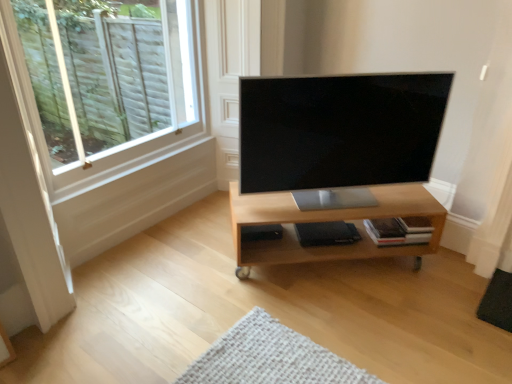
This screenshot has height=384, width=512. In order to click on satin black tv at center in this screenshot , I will do `click(339, 130)`.

This screenshot has height=384, width=512. What do you see at coordinates (339, 130) in the screenshot?
I see `satin black tv at center` at bounding box center [339, 130].

Identify the location of white wood window at upper left. (108, 89).

Based on their sizes in the image, would you say light wood shelf at center is bigger or smaller than white wood window at upper left?

Considering their sizes, light wood shelf at center takes up more space than white wood window at upper left.

Are light wood shelf at center and white wood window at upper left far apart?

light wood shelf at center is far away from white wood window at upper left.

Can you confirm if light wood shelf at center is wider than white wood window at upper left?

Indeed, light wood shelf at center has a greater width compared to white wood window at upper left.

Which is behind, point (371, 241) or point (286, 123)?

The point (371, 241) is farther.

Looking at this image, based on their positions, is light wood shelf at center located to the left or right of satin black tv at center?

light wood shelf at center is positioned on satin black tv at center's left side.

From a real-world perspective, is light wood shelf at center above or below satin black tv at center?

In terms of real-world spatial position, light wood shelf at center is below satin black tv at center.

At what (x,y) coordinates should I click in order to perform the action: click on shelf behind the satin black tv at center. Please return your answer as a coordinate pair (x, y). This screenshot has width=512, height=384. Looking at the image, I should click on (328, 221).

Is white wood window at upper left facing towards satin black tv at center?

Yes, white wood window at upper left is oriented towards satin black tv at center.

Is white wood window at upper left far from satin black tv at center?

Absolutely, white wood window at upper left is distant from satin black tv at center.

Between white wood window at upper left and satin black tv at center, which one is positioned in front?

white wood window at upper left is closer to the camera.

Considering the relative sizes of white wood window at upper left and satin black tv at center in the image provided, is white wood window at upper left wider than satin black tv at center?

In fact, white wood window at upper left might be narrower than satin black tv at center.

This screenshot has height=384, width=512. I want to click on television that appears on the right of light wood shelf at center, so click(x=339, y=130).

Does satin black tv at center touch light wood shelf at center?

No, satin black tv at center is not in contact with light wood shelf at center.

Considering the positions of objects satin black tv at center and light wood shelf at center in the image provided, who is behind, satin black tv at center or light wood shelf at center?

light wood shelf at center is more distant.

Considering the points (313, 183) and (303, 218), which point is in front, point (313, 183) or point (303, 218)?

The point (303, 218) is more forward.

How different are the orientations of satin black tv at center and white wood window at upper left in degrees?

The facing directions of satin black tv at center and white wood window at upper left are 43.9 degrees apart.

From a real-world perspective, which is physically above, satin black tv at center or white wood window at upper left?

white wood window at upper left is physically above.

Is satin black tv at center bigger or smaller than white wood window at upper left?

Clearly, satin black tv at center is smaller in size than white wood window at upper left.

Is satin black tv at center turned away from white wood window at upper left?

No, satin black tv at center is not facing away from white wood window at upper left.

From the image's perspective, is white wood window at upper left located above or below light wood shelf at center?

From the image's perspective, white wood window at upper left appears above light wood shelf at center.

Between white wood window at upper left and light wood shelf at center, which one has smaller size?

white wood window at upper left is smaller.

Which of these two, white wood window at upper left or light wood shelf at center, is wider?

light wood shelf at center is wider.

Locate an element on the screen. shelf on the right of white wood window at upper left is located at coordinates (328, 221).

This screenshot has width=512, height=384. In order to click on television that is above the light wood shelf at center (from the image's perspective) in this screenshot , I will do `click(339, 130)`.

From the image, which object appears to be farther from white wood window at upper left, light wood shelf at center or satin black tv at center?

light wood shelf at center is positioned further to the anchor white wood window at upper left.

Which object lies further to the anchor point light wood shelf at center, satin black tv at center or white wood window at upper left?

Based on the image, white wood window at upper left appears to be further to light wood shelf at center.

When comparing their distances from satin black tv at center, does light wood shelf at center or white wood window at upper left seem closer?

light wood shelf at center is closer to satin black tv at center.

Estimate the real-world distances between objects in this image. Which object is further from light wood shelf at center, white wood window at upper left or satin black tv at center?

The object further to light wood shelf at center is white wood window at upper left.

Looking at this image, looking at the image, which one is located further to white wood window at upper left, satin black tv at center or light wood shelf at center?

light wood shelf at center is further to white wood window at upper left.

When comparing their distances from satin black tv at center, does white wood window at upper left or light wood shelf at center seem closer?

light wood shelf at center lies closer to satin black tv at center than the other object.

Locate an element on the screen. The height and width of the screenshot is (384, 512). shelf between white wood window at upper left and satin black tv at center in the horizontal direction is located at coordinates (328, 221).